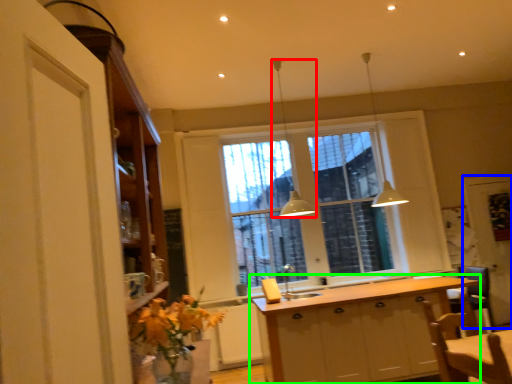
Question: Which object is the farthest from light fixture (highlighted by a red box)? Choose among these: screen door (highlighted by a blue box) or cabinetry (highlighted by a green box).

Choices:
 (A) screen door
 (B) cabinetry

Answer: (A)